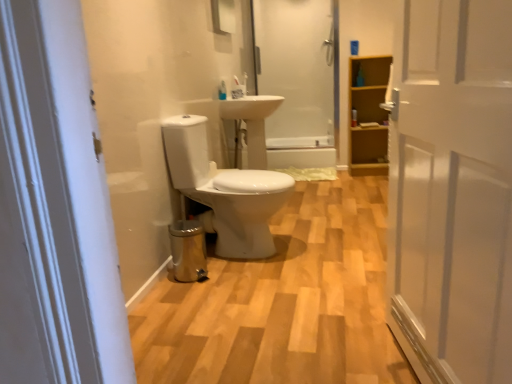
Question: Does white wooden door at right have a lesser width compared to white glossy sink at center?

Choices:
 (A) yes
 (B) no

Answer: (A)

Question: Does white wooden door at right have a lesser height compared to white glossy sink at center?

Choices:
 (A) yes
 (B) no

Answer: (B)

Question: Is white glossy sink at center at the back of white wooden door at right?

Choices:
 (A) yes
 (B) no

Answer: (B)

Question: Can you confirm if white wooden door at right is taller than white glossy sink at center?

Choices:
 (A) no
 (B) yes

Answer: (B)

Question: Is white wooden door at right next to white glossy sink at center and touching it?

Choices:
 (A) no
 (B) yes

Answer: (A)

Question: Considering the relative positions of white wooden door at right and white glossy sink at center in the image provided, is white wooden door at right to the left of white glossy sink at center from the viewer's perspective?

Choices:
 (A) yes
 (B) no

Answer: (B)

Question: Can you confirm if translucent glass shower door at upper center is positioned to the right of white wooden door at right?

Choices:
 (A) yes
 (B) no

Answer: (B)

Question: From the image's perspective, would you say translucent glass shower door at upper center is shown under white wooden door at right?

Choices:
 (A) yes
 (B) no

Answer: (B)

Question: Considering the relative positions of translucent glass shower door at upper center and white wooden door at right in the image provided, is translucent glass shower door at upper center behind white wooden door at right?

Choices:
 (A) yes
 (B) no

Answer: (A)

Question: Is translucent glass shower door at upper center positioned with its back to white wooden door at right?

Choices:
 (A) no
 (B) yes

Answer: (A)

Question: Would you consider translucent glass shower door at upper center to be distant from white wooden door at right?

Choices:
 (A) yes
 (B) no

Answer: (A)

Question: Is translucent glass shower door at upper center closer to the viewer compared to white wooden door at right?

Choices:
 (A) no
 (B) yes

Answer: (A)

Question: From a real-world perspective, is white glossy toilet at center over light brown wood cabinet at right?

Choices:
 (A) no
 (B) yes

Answer: (A)